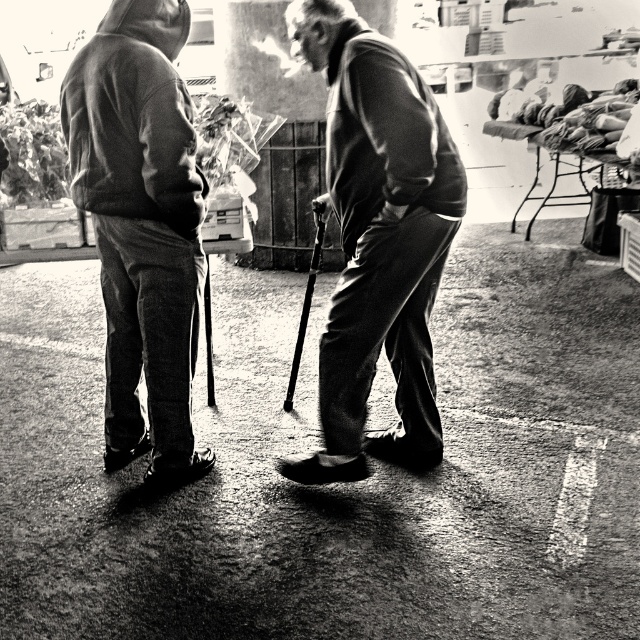
Question: Does dark gray hoodie at left have a lesser width compared to metallic silver ski pole at center?

Choices:
 (A) no
 (B) yes

Answer: (A)

Question: Based on their relative distances, which object is nearer to the dark gray hoodie at left?

Choices:
 (A) metallic silver ski pole at center
 (B) smooth fabric jacket at center
 (C) smooth metal cane at center

Answer: (A)

Question: Which is nearer to the smooth metal cane at center?

Choices:
 (A) metallic silver ski pole at center
 (B) smooth fabric jacket at center
 (C) dark gray hoodie at left

Answer: (A)

Question: Does dark gray hoodie at left appear on the right side of smooth metal cane at center?

Choices:
 (A) yes
 (B) no

Answer: (B)

Question: Which of these objects is positioned farthest from the metallic silver ski pole at center?

Choices:
 (A) dark gray hoodie at left
 (B) smooth fabric jacket at center

Answer: (B)

Question: Where is dark gray hoodie at left located in relation to metallic silver ski pole at center in the image?

Choices:
 (A) left
 (B) right

Answer: (A)